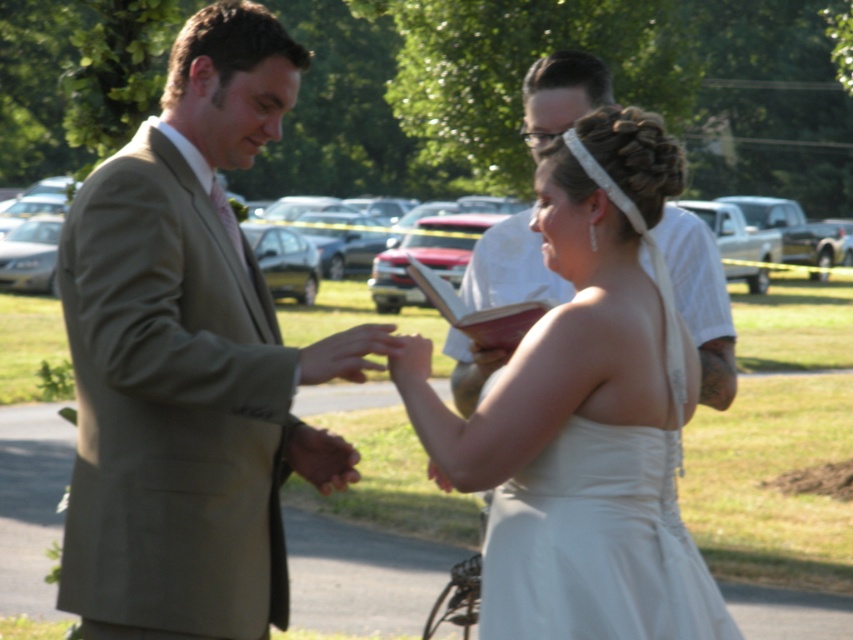
From the picture: You are a photographer at a wedding and need to capture a photo of the light brown suit at center and the white satin dress at center. Which one of these two objects is closer to you?

The light brown suit at center is closer to you than the white satin dress at center.

You are a photographer at a wedding and need to position a bouquet between the white satin dress at center and the white textured book at upper center so it doesn t block either. Which object should the bouquet be placed closer to to ensure it fits within the available space?

The bouquet should be placed closer to the white textured book at upper center because the white satin dress at center is wider than the white textured book at upper center, leaving more space near the book.